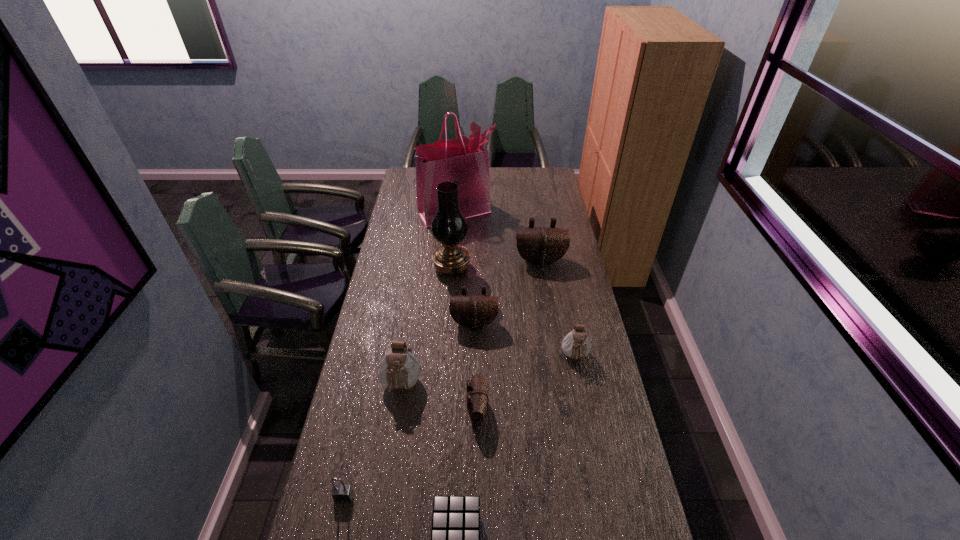
This screenshot has width=960, height=540. I want to click on the smaller white pouch, so click(x=576, y=344).

Locate an element on the screen. the smallest brown pouch is located at coordinates (477, 398).

Find the location of a particular element. the second nearest object is located at coordinates (342, 493).

At what (x,y) coordinates should I click in order to perform the action: click on padlock. Please return your answer as a coordinate pair (x, y). This screenshot has width=960, height=540. Looking at the image, I should click on [342, 493].

The height and width of the screenshot is (540, 960). I want to click on blank space located 0.250m on the front of the pink shopping bag, so click(x=452, y=261).

Find the location of a particular element. This screenshot has width=960, height=540. free space located 0.130m on the front of the brown oil lamp is located at coordinates (449, 302).

Image resolution: width=960 pixels, height=540 pixels. I want to click on vacant space located with the flap open on the farthest brown pouch, so click(547, 307).

At what (x,y) coordinates should I click in order to perform the action: click on vacant space located 0.070m on the front-facing side of the bigger white pouch. Please return your answer as a coordinate pair (x, y). This screenshot has width=960, height=540. Looking at the image, I should click on (396, 428).

Locate an element on the screen. This screenshot has width=960, height=540. vacant space located 0.270m with the flap open on the fourth farthest object is located at coordinates (473, 395).

Find the location of a particular element. free spot located 0.160m on the front-facing side of the smaller white pouch is located at coordinates (586, 413).